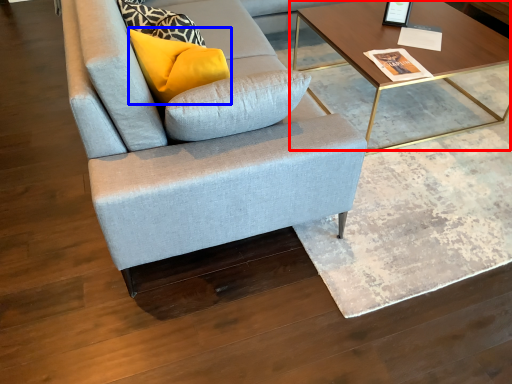
Question: Which of the following is the farthest to the observer, coffee table (highlighted by a red box) or pillow (highlighted by a blue box)?

Choices:
 (A) coffee table
 (B) pillow

Answer: (A)